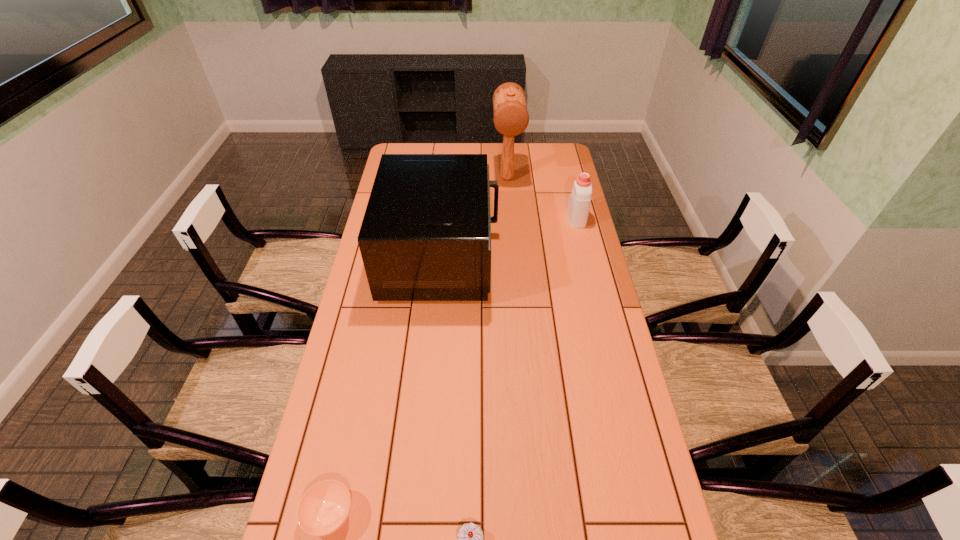
At what (x,y) coordinates should I click in order to perform the action: click on object present at the far edge. Please return your answer as a coordinate pair (x, y). Looking at the image, I should click on (511, 118).

You are a GUI agent. You are given a task and a screenshot of the screen. Output one action in this format:
    pyautogui.click(x=<x>, y=<y>)
    Task: Click on the object positioned at the left edge
    Image resolution: width=960 pixels, height=540 pixels.
    Given the screenshot: What is the action you would take?
    pyautogui.click(x=426, y=233)

At what (x,y) coordinates should I click in order to perform the action: click on object that is at the right edge. Please return your answer as a coordinate pair (x, y). Image resolution: width=960 pixels, height=540 pixels. Looking at the image, I should click on (578, 206).

At what (x,y) coordinates should I click in order to perform the action: click on vacant space at the far edge of the desktop. Please return your answer as a coordinate pair (x, y). The image size is (960, 540). Looking at the image, I should click on (522, 147).

In order to click on free region at the left edge of the desktop in this screenshot , I will do click(x=345, y=333).

In order to click on vacant region at the right edge of the desktop in this screenshot , I will do `click(586, 251)`.

In the image, there is a desktop. In order to click on free space at the far right corner in this screenshot , I will do `click(567, 159)`.

I want to click on free space between the microwave_oven and the detergent, so click(x=509, y=237).

Find the location of a particular element. free space between the farthest object and the detergent is located at coordinates (541, 198).

Locate an element on the screen. object that can be found as the third closest to the cupcake is located at coordinates (578, 206).